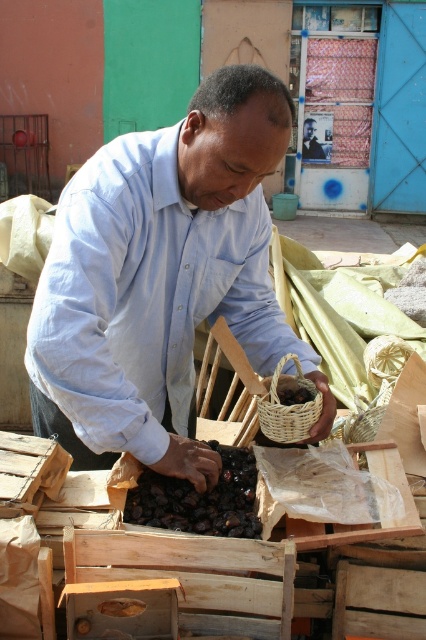
Question: Can you confirm if light blue shirt at center is positioned to the left of matte blue shirt at center?

Choices:
 (A) no
 (B) yes

Answer: (B)

Question: Which point is farther from the camera taking this photo?

Choices:
 (A) (305, 136)
 (B) (187, 292)

Answer: (A)

Question: Observing the image, what is the correct spatial positioning of light blue shirt at center in reference to matte blue shirt at center?

Choices:
 (A) below
 (B) above

Answer: (A)

Question: Which object appears closest to the camera in this image?

Choices:
 (A) light blue shirt at center
 (B) matte blue shirt at center
 (C) woven brown basket at center

Answer: (A)

Question: Which object is farther from the camera taking this photo?

Choices:
 (A) dark brown dried fruit at center
 (B) matte blue shirt at center
 (C) woven brown basket at center

Answer: (B)

Question: Is light blue shirt at center below woven brown basket at center?

Choices:
 (A) yes
 (B) no

Answer: (B)